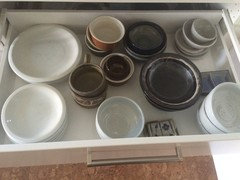
Image resolution: width=240 pixels, height=180 pixels. Identify the location of drawer handle. (145, 158).